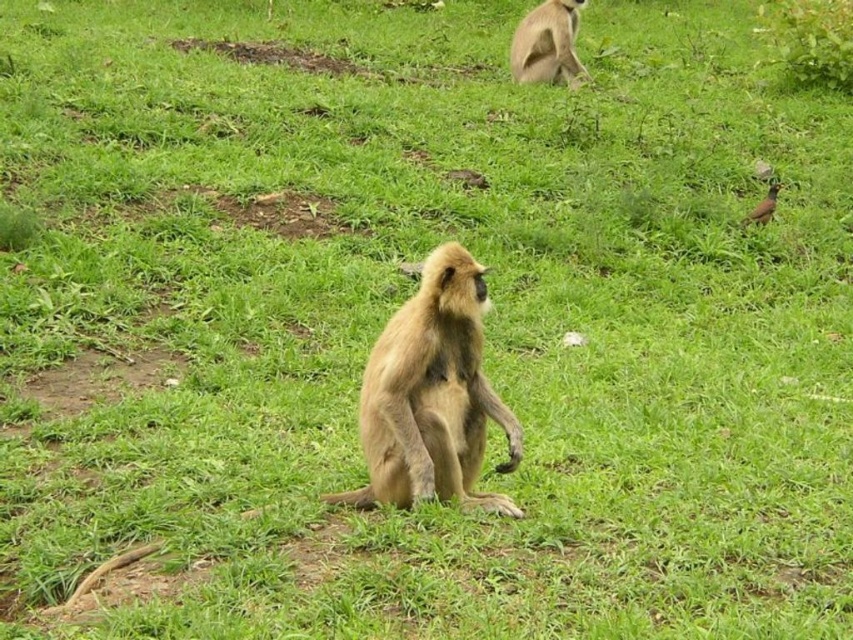
Does golden fur monkey at center have a lesser height compared to light brown fur monkey at upper center?

No, golden fur monkey at center is not shorter than light brown fur monkey at upper center.

Where is `golden fur monkey at center`? This screenshot has width=853, height=640. golden fur monkey at center is located at coordinates (432, 396).